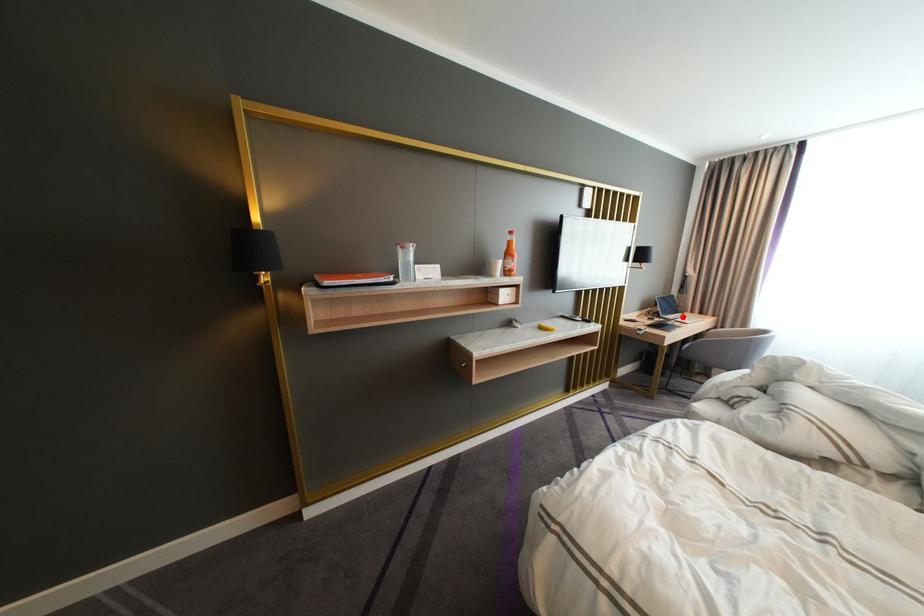
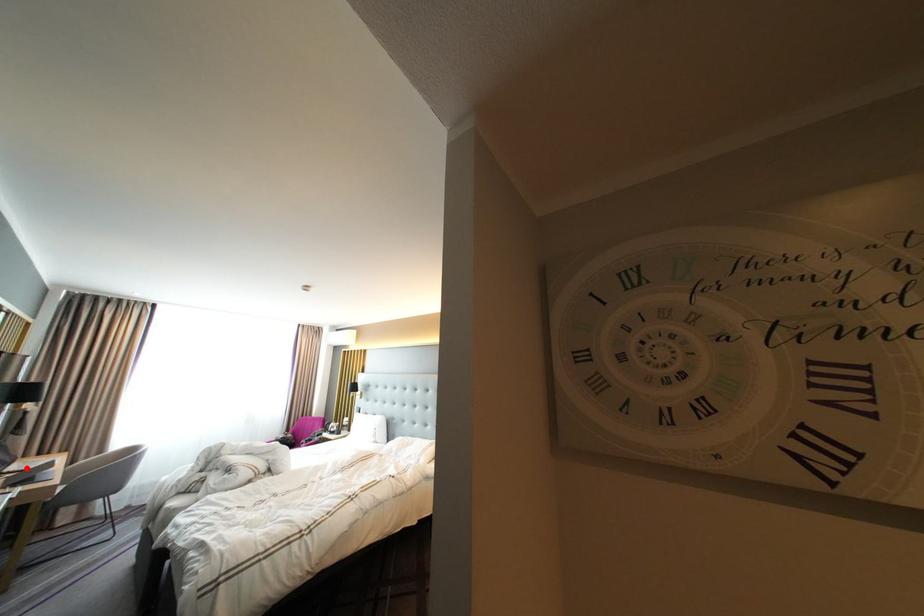
Looking at this image, I am providing you with two images of the same scene from different viewpoints. A red point is marked on the first image and another point is marked on the second image. Is the marked point in image1 the same physical position as the marked point in image2?

Yes